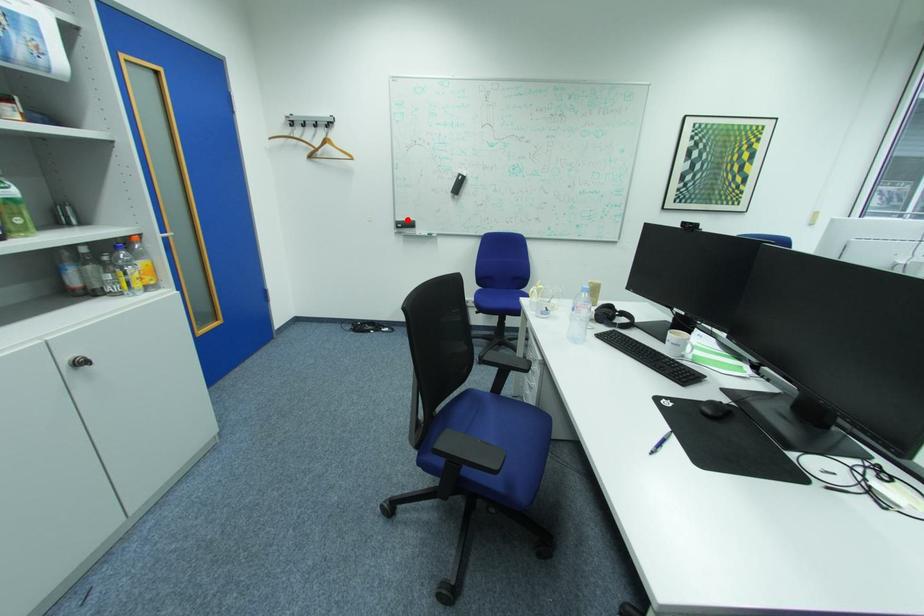
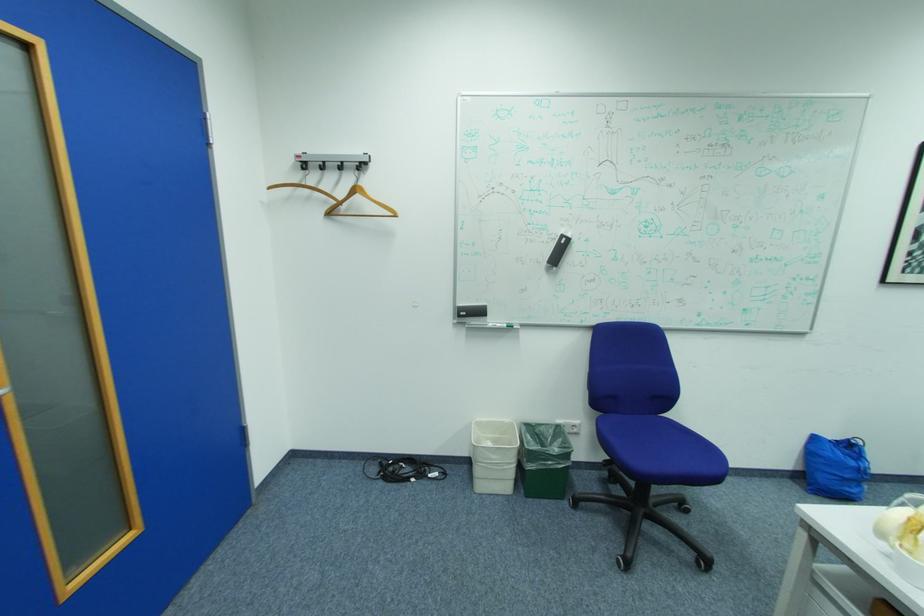
Locate, in the second image, the point that corresponds to the highlighted location in the first image.

(469, 305)